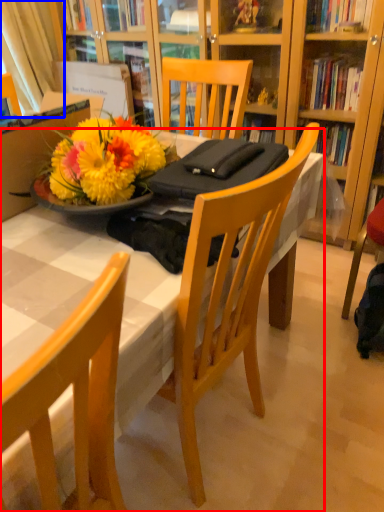
Question: Which of the following is the farthest to the observer, desk (highlighted by a red box) or curtain (highlighted by a blue box)?

Choices:
 (A) desk
 (B) curtain

Answer: (B)